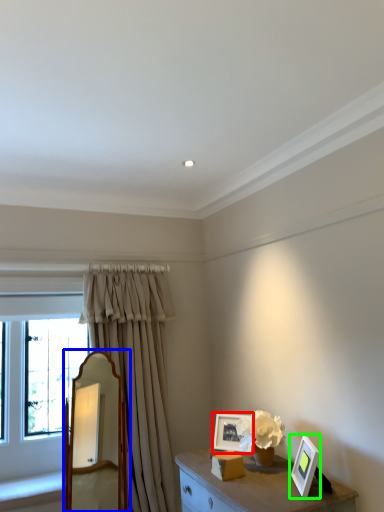
Question: Which is farther away from picture frame (highlighted by a red box)? mirror (highlighted by a blue box) or picture frame (highlighted by a green box)?

Choices:
 (A) mirror
 (B) picture frame

Answer: (A)